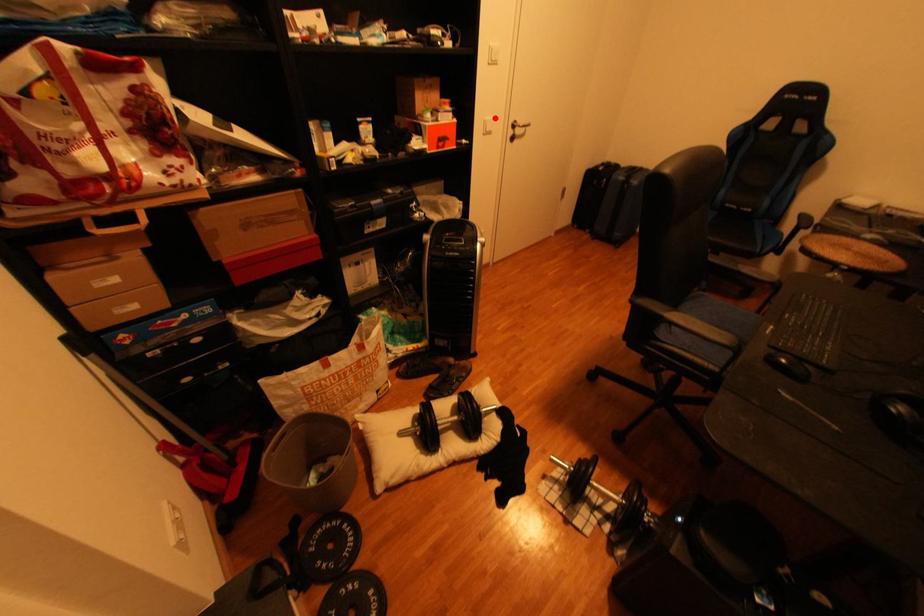
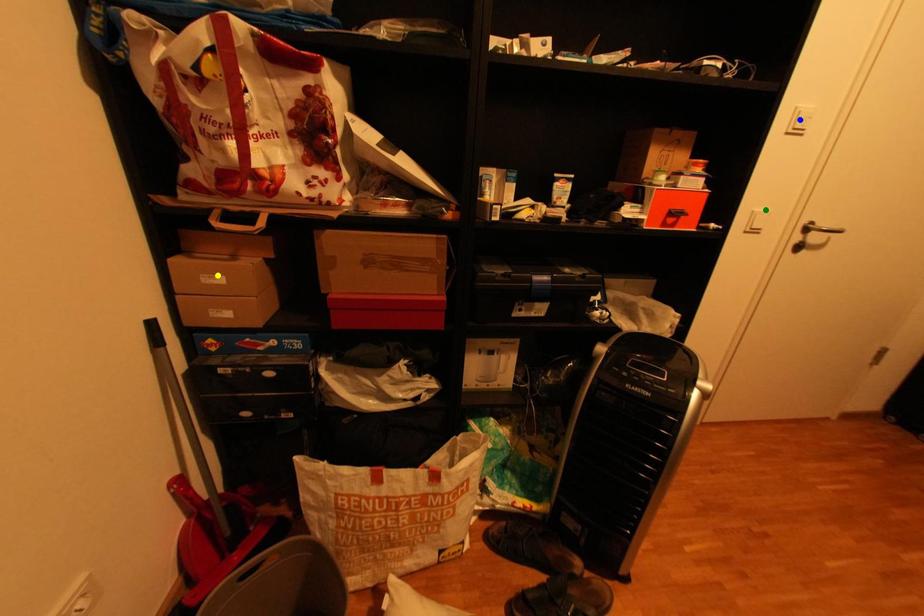
Question: I am providing you with two images of the same scene from different viewpoints. A red point is marked on the first image. You are given multiple points on the second image. Which point in image 2 represents the same 3d spot as the red point in image 1?

Choices:
 (A) blue point
 (B) green point
 (C) yellow point

Answer: (B)